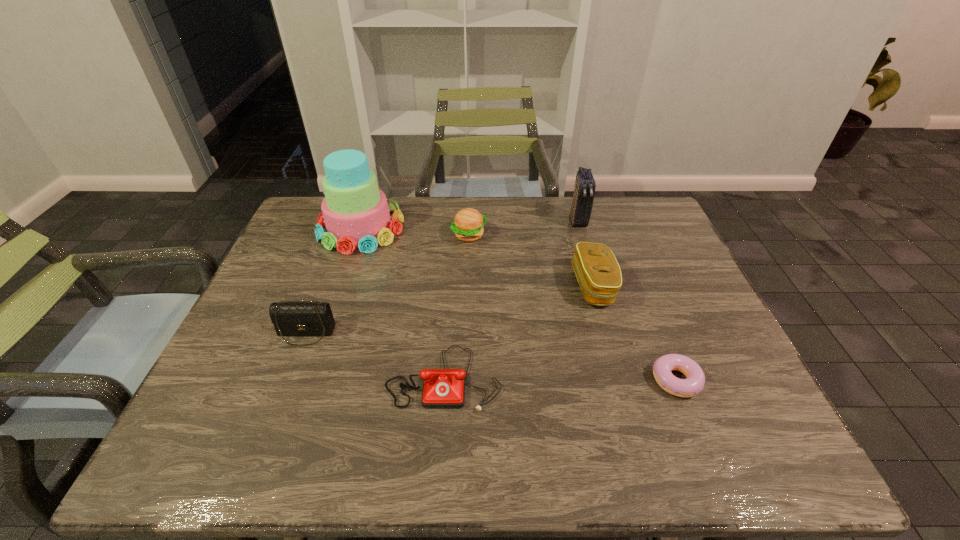
Image resolution: width=960 pixels, height=540 pixels. Identify the location of free space located 0.350m on the right of the tallest object. (515, 227).

The height and width of the screenshot is (540, 960). Identify the location of free space located 0.310m with the zip open on the sixth shortest object. (601, 301).

The width and height of the screenshot is (960, 540). I want to click on vacant region located on the zipper side of the second farthest clutch bag, so click(x=522, y=286).

The width and height of the screenshot is (960, 540). In order to click on free space located on the zipper side of the second farthest clutch bag in this screenshot , I will do `click(434, 286)`.

Image resolution: width=960 pixels, height=540 pixels. Identify the location of free location located 0.340m on the zipper side of the second farthest clutch bag. (448, 286).

I want to click on vacant space located on the left of the hamburger, so click(x=348, y=235).

Find the location of `vacant space positioned 0.280m on the front flap of the leftmost clutch bag`. vacant space positioned 0.280m on the front flap of the leftmost clutch bag is located at coordinates (256, 462).

Find the location of a particular element. The height and width of the screenshot is (540, 960). vacant space positioned on the dial of the second shortest object is located at coordinates (440, 436).

The width and height of the screenshot is (960, 540). In order to click on vacant space located 0.310m on the left of the shortest object in this screenshot , I will do `click(512, 380)`.

I want to click on cake located at the far edge, so click(x=355, y=212).